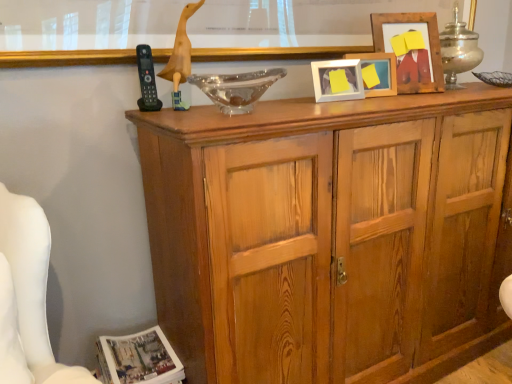
Question: Does wooden cabinet at center contain wooden duck at upper center?

Choices:
 (A) yes
 (B) no

Answer: (B)

Question: Does wooden cabinet at center have a lesser width compared to wooden duck at upper center?

Choices:
 (A) no
 (B) yes

Answer: (A)

Question: Considering the relative sizes of wooden cabinet at center and wooden duck at upper center in the image provided, is wooden cabinet at center shorter than wooden duck at upper center?

Choices:
 (A) yes
 (B) no

Answer: (B)

Question: Are wooden cabinet at center and wooden duck at upper center beside each other?

Choices:
 (A) yes
 (B) no

Answer: (B)

Question: Is wooden cabinet at center bigger than wooden duck at upper center?

Choices:
 (A) yes
 (B) no

Answer: (A)

Question: Is white glossy magazine at lower left wider or thinner than wooden picture frame at upper right, which appears as the 1th picture frame when viewed from the right?

Choices:
 (A) wide
 (B) thin

Answer: (A)

Question: Considering the positions of white glossy magazine at lower left and wooden picture frame at upper right, the 3th picture frame positioned from the left, in the image, is white glossy magazine at lower left bigger or smaller than wooden picture frame at upper right, the 3th picture frame positioned from the left,?

Choices:
 (A) big
 (B) small

Answer: (A)

Question: Is white glossy magazine at lower left inside or outside of wooden picture frame at upper right, which appears as the 1th picture frame when viewed from the right?

Choices:
 (A) inside
 (B) outside

Answer: (B)

Question: Considering the relative positions of white glossy magazine at lower left and wooden picture frame at upper right, which appears as the 1th picture frame when viewed from the right, in the image provided, is white glossy magazine at lower left to the left or to the right of wooden picture frame at upper right, which appears as the 1th picture frame when viewed from the right,?

Choices:
 (A) right
 (B) left

Answer: (B)

Question: From a real-world perspective, relative to transparent glass bowl at center, is wooden duck at upper center vertically above or below?

Choices:
 (A) above
 (B) below

Answer: (A)

Question: Considering the relative positions of wooden duck at upper center and transparent glass bowl at center in the image provided, is wooden duck at upper center to the left or to the right of transparent glass bowl at center?

Choices:
 (A) left
 (B) right

Answer: (A)

Question: Relative to transparent glass bowl at center, is wooden duck at upper center in front or behind?

Choices:
 (A) behind
 (B) front

Answer: (A)

Question: Based on their sizes in the image, would you say wooden duck at upper center is bigger or smaller than transparent glass bowl at center?

Choices:
 (A) big
 (B) small

Answer: (B)

Question: Based on their positions, is white matte picture frame at upper center, the 3th picture frame in the right-to-left sequence, located to the left or right of wooden duck at upper center?

Choices:
 (A) left
 (B) right

Answer: (B)

Question: Is white matte picture frame at upper center, the 3th picture frame in the right-to-left sequence, taller or shorter than wooden duck at upper center?

Choices:
 (A) short
 (B) tall

Answer: (A)